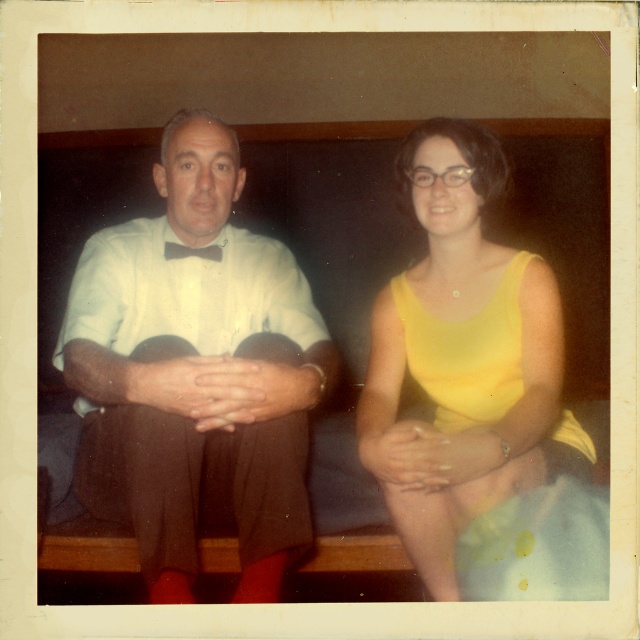
Is matte white shirt at center below yellow matte dress at center?

No.

Does matte white shirt at center appear on the right side of yellow matte dress at center?

No, matte white shirt at center is not to the right of yellow matte dress at center.

Between point (186, 333) and point (458, 404), which one is positioned behind?

The point (186, 333) is behind.

You are a GUI agent. You are given a task and a screenshot of the screen. Output one action in this format:
    pyautogui.click(x=<x>, y=<y>)
    Task: Click on the matte white shirt at center
    Image resolution: width=640 pixels, height=640 pixels.
    Given the screenshot: What is the action you would take?
    pyautogui.click(x=195, y=372)